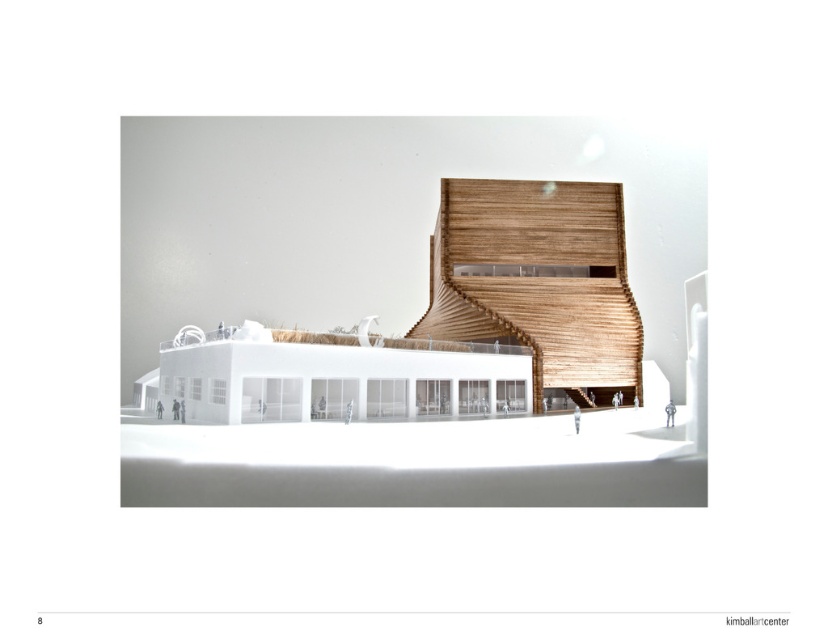
You are an architect reviewing the model of a modern building. You notice two wooden elements at the center of the model. Which one is larger in size between the wooden staircase at center and the wooden slats at center?

The wooden staircase at center is bigger than the wooden slats at center.